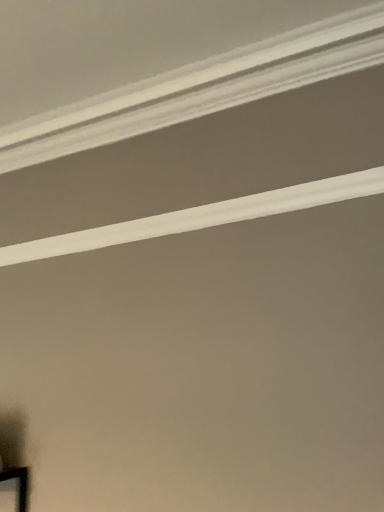
Question: Looking at the image, does white smooth crown molding at upper center, arranged as the 1th strip when ordered from the bottom, seem bigger or smaller compared to white smooth crown molding at upper center, which is counted as the first strip, starting from the top?

Choices:
 (A) big
 (B) small

Answer: (B)

Question: Is white smooth crown molding at upper center, arranged as the 1th strip when ordered from the bottom, inside the boundaries of white smooth crown molding at upper center, the second strip positioned from the bottom, or outside?

Choices:
 (A) inside
 (B) outside

Answer: (B)

Question: Considering their positions, is white smooth crown molding at upper center, which is the 2th strip in top-to-bottom order, located in front of or behind white smooth crown molding at upper center, the second strip positioned from the bottom?

Choices:
 (A) behind
 (B) front

Answer: (A)

Question: From a real-world perspective, is white smooth crown molding at upper center, the second strip positioned from the bottom, above or below white smooth crown molding at upper center, which is the 2th strip in top-to-bottom order?

Choices:
 (A) below
 (B) above

Answer: (B)

Question: Considering their positions, is white smooth crown molding at upper center, the second strip positioned from the bottom, located in front of or behind white smooth crown molding at upper center, which is the 2th strip in top-to-bottom order?

Choices:
 (A) front
 (B) behind

Answer: (A)

Question: From their relative heights in the image, would you say white smooth crown molding at upper center, the second strip positioned from the bottom, is taller or shorter than white smooth crown molding at upper center, arranged as the 1th strip when ordered from the bottom?

Choices:
 (A) tall
 (B) short

Answer: (B)

Question: Considering the positions of point (112, 100) and point (19, 259), is point (112, 100) closer or farther from the camera than point (19, 259)?

Choices:
 (A) closer
 (B) farther

Answer: (A)